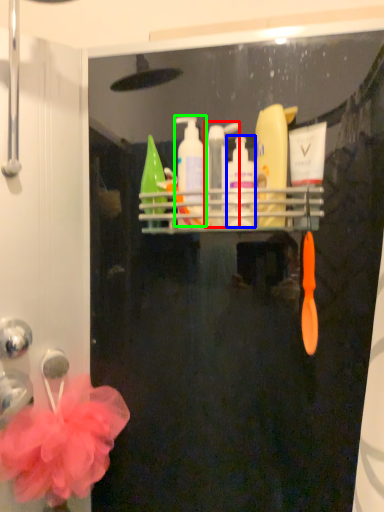
Question: Which is nearer to the mouthwash (highlighted by a red box)? cleaning product (highlighted by a blue box) or cleaning product (highlighted by a green box).

Choices:
 (A) cleaning product
 (B) cleaning product

Answer: (A)